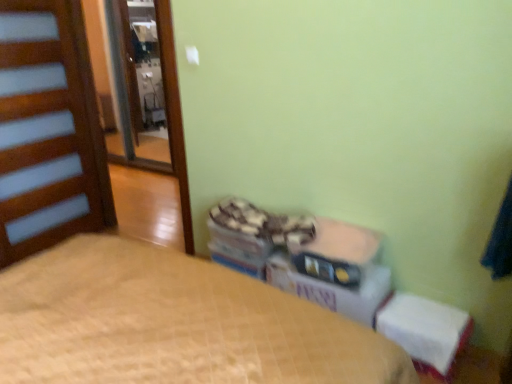
Question: Is matte plastic storage box at center beside white cardboard box at center?

Choices:
 (A) yes
 (B) no

Answer: (B)

Question: Is matte plastic storage box at center far away from white cardboard box at center?

Choices:
 (A) yes
 (B) no

Answer: (B)

Question: Is matte plastic storage box at center taller than white cardboard box at center?

Choices:
 (A) yes
 (B) no

Answer: (B)

Question: Considering the relative sizes of matte plastic storage box at center and white cardboard box at center in the image provided, is matte plastic storage box at center bigger than white cardboard box at center?

Choices:
 (A) yes
 (B) no

Answer: (B)

Question: Is white cardboard box at center inside matte plastic storage box at center?

Choices:
 (A) no
 (B) yes

Answer: (A)

Question: From a real-world perspective, is wooden door at left physically located above or below beige quilted bed at center?

Choices:
 (A) below
 (B) above

Answer: (B)

Question: Based on their sizes in the image, would you say wooden door at left is bigger or smaller than beige quilted bed at center?

Choices:
 (A) big
 (B) small

Answer: (B)

Question: In the image, is wooden door at left positioned in front of or behind beige quilted bed at center?

Choices:
 (A) front
 (B) behind

Answer: (B)

Question: In terms of width, does wooden door at left look wider or thinner when compared to beige quilted bed at center?

Choices:
 (A) thin
 (B) wide

Answer: (A)

Question: Is white cardboard box at center spatially inside matte plastic storage box at center, or outside of it?

Choices:
 (A) inside
 (B) outside

Answer: (B)

Question: Considering the positions of white cardboard box at center and matte plastic storage box at center in the image, is white cardboard box at center taller or shorter than matte plastic storage box at center?

Choices:
 (A) short
 (B) tall

Answer: (B)

Question: Is white cardboard box at center bigger or smaller than matte plastic storage box at center?

Choices:
 (A) small
 (B) big

Answer: (B)

Question: Considering the positions of point 330,307 and point 336,221, is point 330,307 closer or farther from the camera than point 336,221?

Choices:
 (A) closer
 (B) farther

Answer: (A)

Question: In terms of size, does brown wooden screen door at left appear bigger or smaller than beige quilted bed at center?

Choices:
 (A) small
 (B) big

Answer: (A)

Question: From a real-world perspective, relative to beige quilted bed at center, is brown wooden screen door at left vertically above or below?

Choices:
 (A) above
 (B) below

Answer: (A)